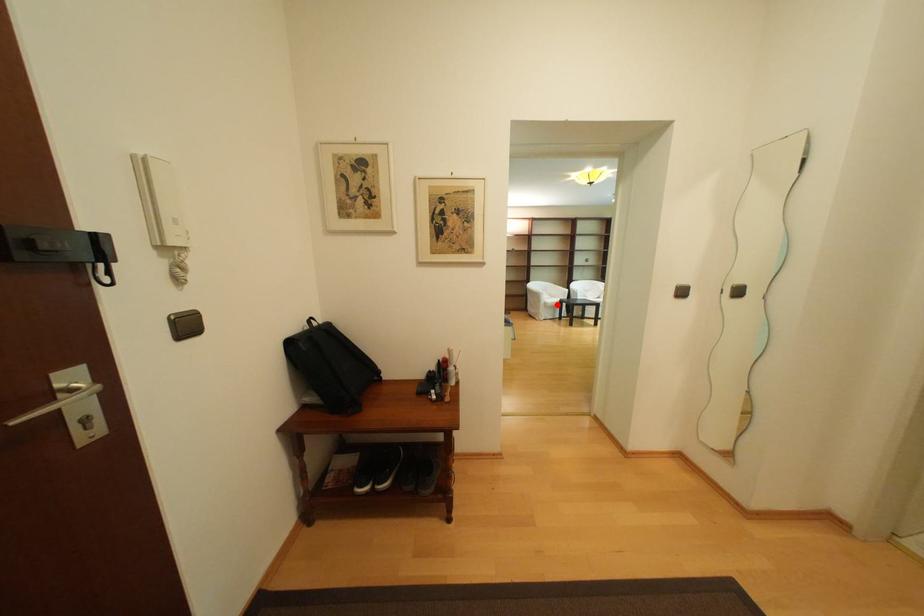
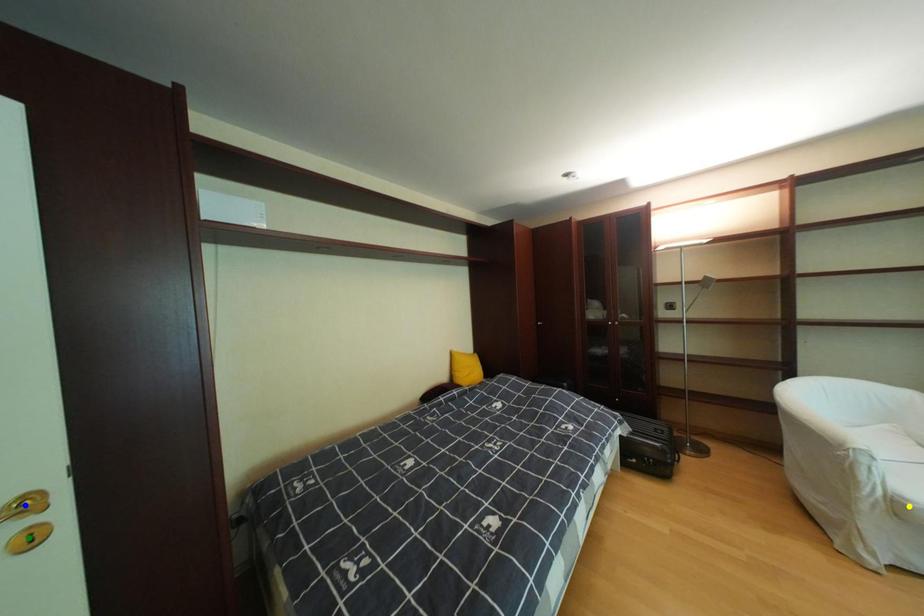
Question: I am providing you with two images of the same scene from different viewpoints. A red point is marked on the first image. You are given multiple points on the second image. Can you choose the point in image 2 that corresponds to the point in image 1?

Choices:
 (A) yellow point
 (B) blue point
 (C) green point

Answer: (A)